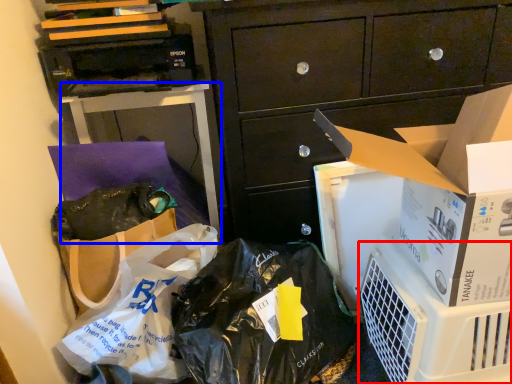
Question: Which point is closer to the camera, appliance (highlighted by a red box) or desk (highlighted by a blue box)?

Choices:
 (A) appliance
 (B) desk

Answer: (A)